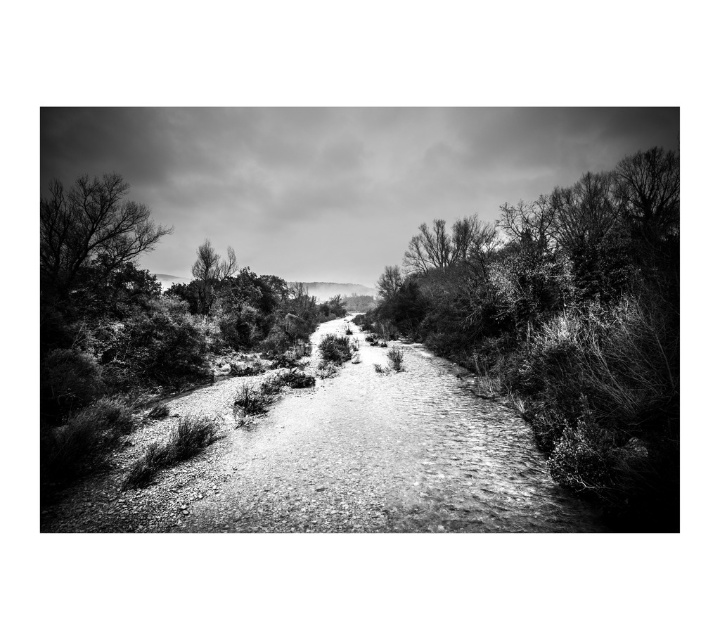
You are a hiker planning to follow the gravelly path at center in the photograph. Based on the scene description, what can you infer about the path ahead as it extends into the distance?

The gravelly path at center is located at point (567, 326), which suggests it is positioned centrally in the image and extends towards the distance, flanked by dense vegetation on both sides, indicating it continues into a natural, possibly less accessible area.